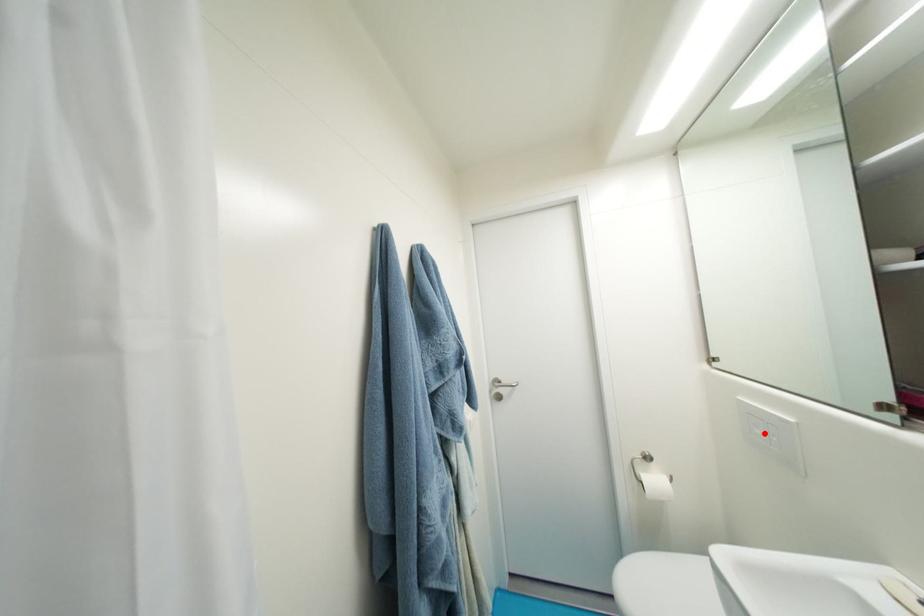
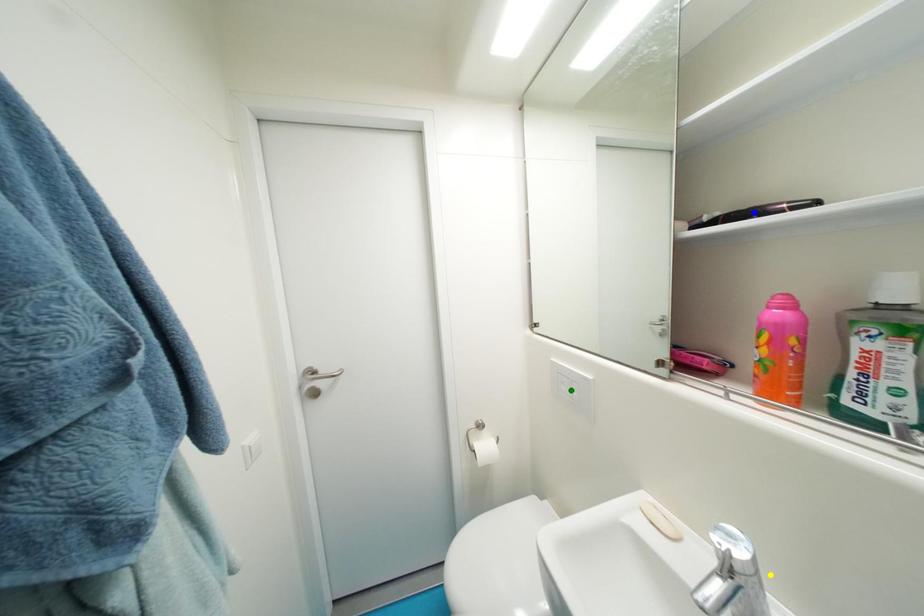
Question: I am providing you with two images of the same scene from different viewpoints. A red point is marked on the first image. You are given multiple points on the second image. Which mark in image 2 goes with the point in image 1?

Choices:
 (A) yellow point
 (B) blue point
 (C) green point

Answer: (C)